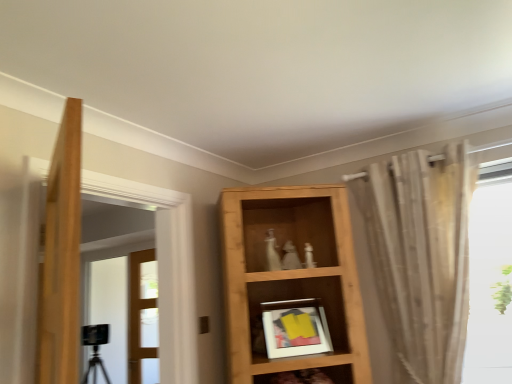
Question: Is black glass door at left, positioned as the 2th door in right-to-left order, at the right side of sheer beige curtain at right?

Choices:
 (A) yes
 (B) no

Answer: (B)

Question: Is black glass door at left, positioned as the 2th door in right-to-left order, positioned beyond the bounds of sheer beige curtain at right?

Choices:
 (A) yes
 (B) no

Answer: (A)

Question: From a real-world perspective, is black glass door at left, positioned as the 1th door in left-to-right order, on sheer beige curtain at right?

Choices:
 (A) no
 (B) yes

Answer: (A)

Question: Does black glass door at left, positioned as the 1th door in left-to-right order, have a lesser height compared to sheer beige curtain at right?

Choices:
 (A) yes
 (B) no

Answer: (B)

Question: Is sheer beige curtain at right surrounded by black glass door at left, positioned as the 2th door in right-to-left order?

Choices:
 (A) no
 (B) yes

Answer: (A)

Question: Considering their positions, is wooden shelf at center, which ranks as the second shelf in bottom-to-top order, located in front of or behind wooden shelf at lower center, which is the second shelf in top-to-bottom order?

Choices:
 (A) behind
 (B) front

Answer: (A)

Question: From the image's perspective, is wooden shelf at center, the first shelf when ordered from top to bottom, located above or below wooden shelf at lower center, which is the second shelf in top-to-bottom order?

Choices:
 (A) above
 (B) below

Answer: (A)

Question: Looking at their shapes, would you say wooden shelf at center, the first shelf when ordered from top to bottom, is wider or thinner than wooden shelf at lower center, acting as the first shelf starting from the bottom?

Choices:
 (A) wide
 (B) thin

Answer: (A)

Question: From a real-world perspective, relative to wooden shelf at lower center, acting as the first shelf starting from the bottom, is wooden shelf at center, which ranks as the second shelf in bottom-to-top order, vertically above or below?

Choices:
 (A) below
 (B) above

Answer: (B)

Question: Is point 139,306 closer or farther from the camera than point 99,319?

Choices:
 (A) farther
 (B) closer

Answer: (B)

Question: Considering the positions of clear glass door at center, marked as the 2th door in a left-to-right arrangement, and black glass door at left, positioned as the 1th door in left-to-right order, in the image, is clear glass door at center, marked as the 2th door in a left-to-right arrangement, taller or shorter than black glass door at left, positioned as the 1th door in left-to-right order,?

Choices:
 (A) tall
 (B) short

Answer: (B)

Question: From a real-world perspective, is clear glass door at center, marked as the 2th door in a left-to-right arrangement, above or below black glass door at left, positioned as the 1th door in left-to-right order?

Choices:
 (A) below
 (B) above

Answer: (A)

Question: Is clear glass door at center, the first door positioned from the right, spatially inside black glass door at left, positioned as the 1th door in left-to-right order, or outside of it?

Choices:
 (A) outside
 (B) inside

Answer: (B)

Question: Is black glass door at left, positioned as the 1th door in left-to-right order, wider or thinner than wooden shelf at lower center, which is the second shelf in top-to-bottom order?

Choices:
 (A) thin
 (B) wide

Answer: (A)

Question: Is black glass door at left, positioned as the 2th door in right-to-left order, taller or shorter than wooden shelf at lower center, acting as the first shelf starting from the bottom?

Choices:
 (A) tall
 (B) short

Answer: (A)